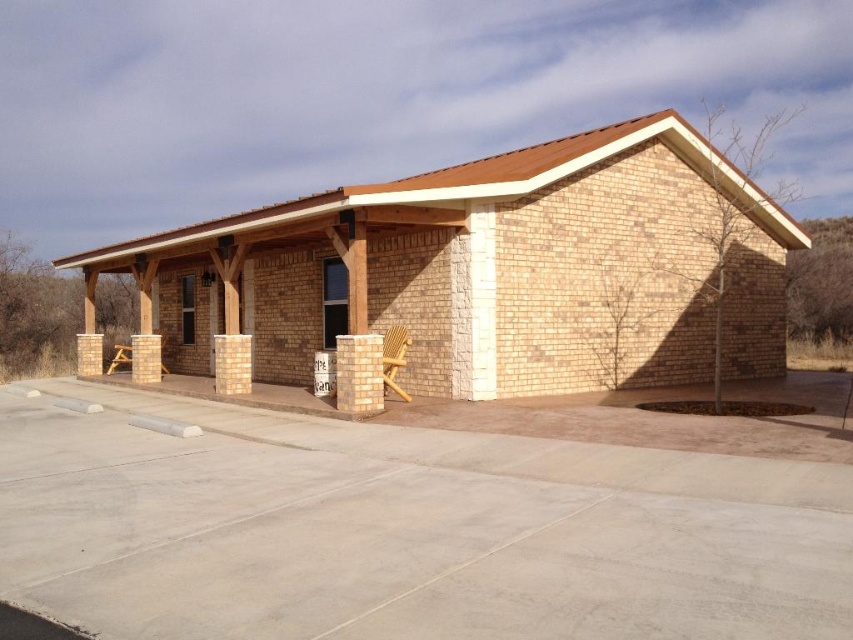
Question: Which of these objects is positioned farthest from the light brown brick pillar at center?

Choices:
 (A) beige brick pillar at center
 (B) beige stone pillar at center

Answer: (B)

Question: Among these objects, which one is farthest from the camera?

Choices:
 (A) light brown wooden chair at center
 (B) beige stone pillar at center

Answer: (B)

Question: Which point is closer to the camera taking this photo?

Choices:
 (A) (155, 358)
 (B) (213, 340)
 (C) (387, 372)
 (D) (358, 371)

Answer: (D)

Question: Is light brown brick pillar at center below beige stone pillar at center?

Choices:
 (A) no
 (B) yes

Answer: (A)

Question: Can you confirm if beige brick pillar at center is thinner than beige stone pillar at center?

Choices:
 (A) no
 (B) yes

Answer: (A)

Question: Is beige brick pillar at center to the left of light brown wooden chair at center from the viewer's perspective?

Choices:
 (A) no
 (B) yes

Answer: (B)